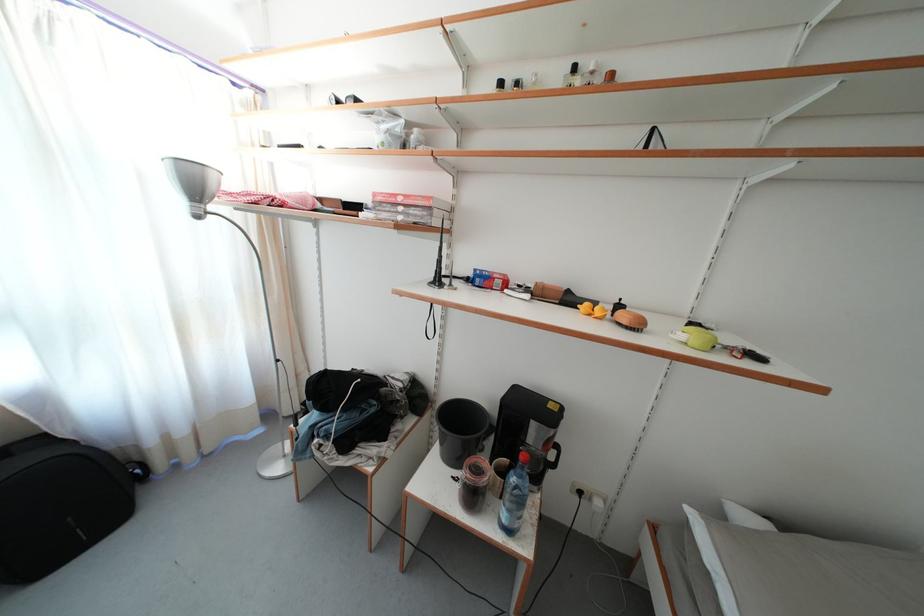
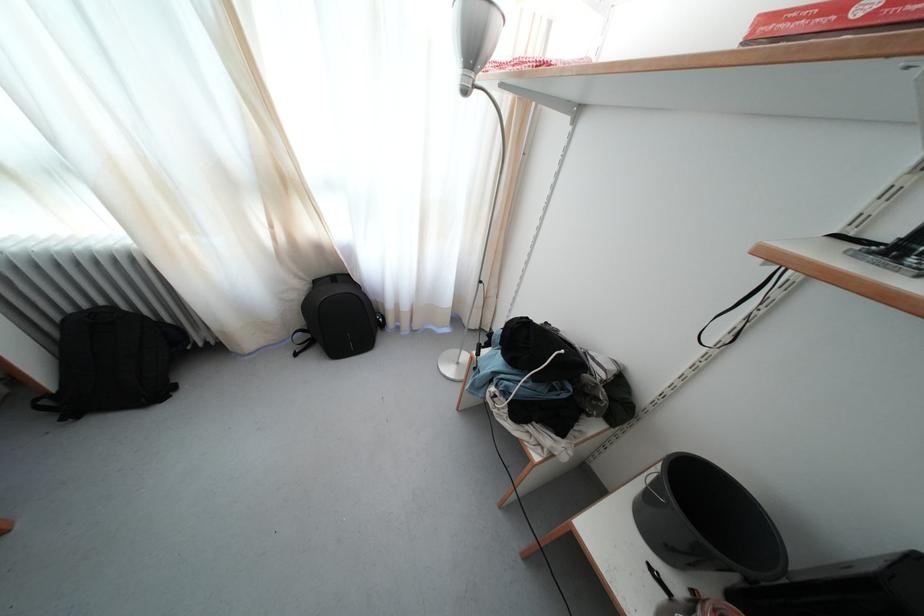
The images are taken continuously from a first-person perspective. In which direction is your viewpoint rotating?

The camera's rotation is toward left-down.